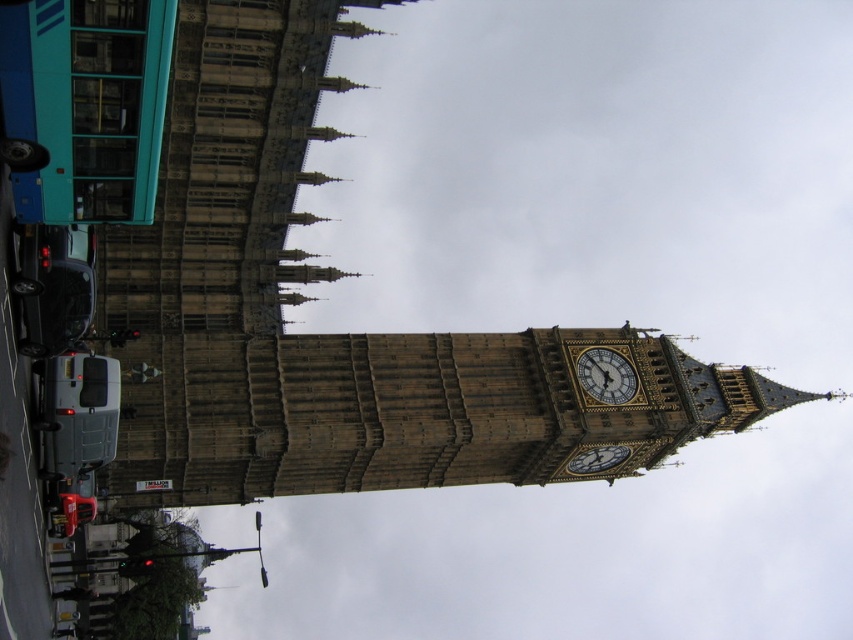
Question: Does polished brass clock at center have a smaller size compared to gold ornate clock at center?

Choices:
 (A) no
 (B) yes

Answer: (B)

Question: Is polished brass clock at center further to the viewer compared to gold ornate clock at center?

Choices:
 (A) no
 (B) yes

Answer: (A)

Question: Is polished brass clock at center thinner than gold ornate clock at center?

Choices:
 (A) no
 (B) yes

Answer: (B)

Question: Which of the following is the farthest from the observer?

Choices:
 (A) gold ornate clock at center
 (B) polished brass clock at center

Answer: (A)